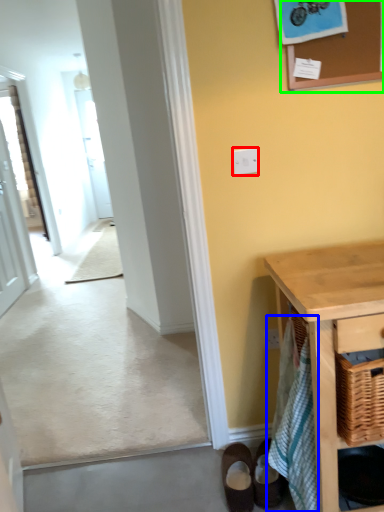
Question: Estimate the real-world distances between objects in this image. Which object is closer to light switch (highlighted by a red box), bath towel (highlighted by a blue box) or bulletin board (highlighted by a green box)?

Choices:
 (A) bath towel
 (B) bulletin board

Answer: (B)